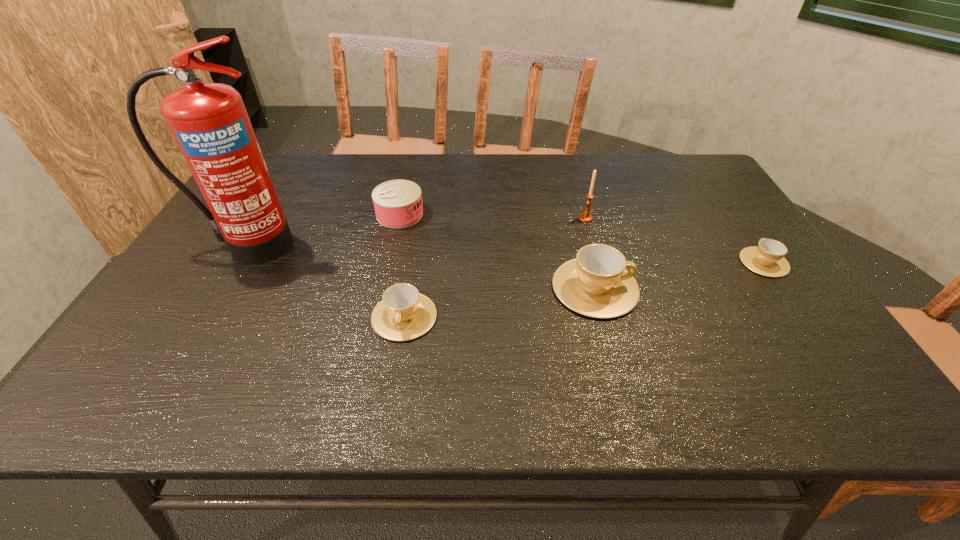
Given the evenly spaced cups in the image, where should an extra cup be added on the left to preserve the spacing? Please point to a vacant space. Please provide its 2D coordinates. Your answer should be formatted as a tuple, i.e. [(x, y)], where the tuple contains the x and y coordinates of a point satisfying the conditions above.

[(186, 349)]